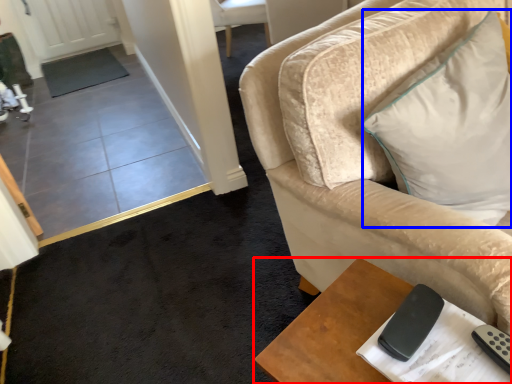
Question: Which point is further to the camera, table (highlighted by a red box) or pillow (highlighted by a blue box)?

Choices:
 (A) table
 (B) pillow

Answer: (B)